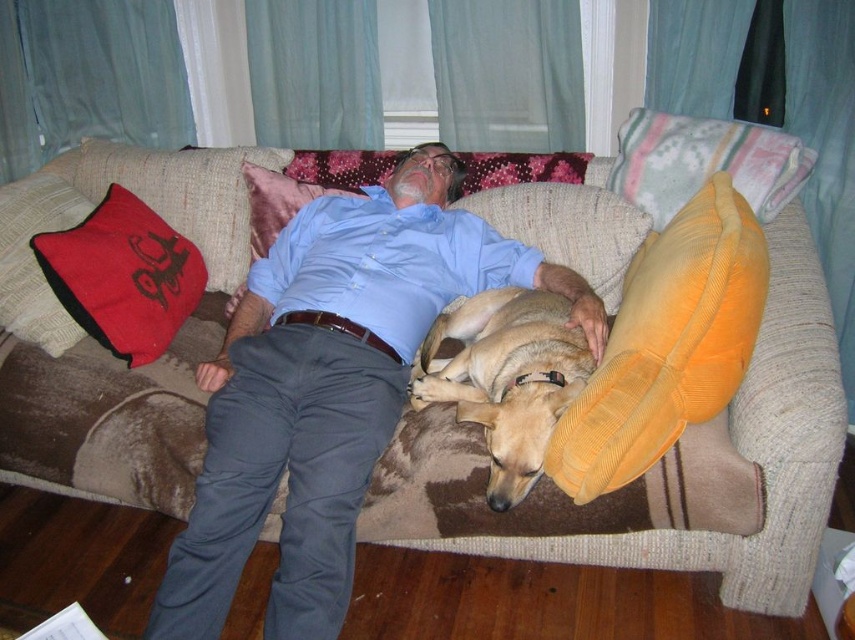
In the image, where is the brown corduroy dog at center located in terms of coordinates?

The brown corduroy dog at center is located at coordinates point (506, 378).

You are standing in the living room and want to place a small plant between the two points marked as point (287, 404) and point (615, 342). Which point should the plant be closer to so it appears closer to you?

The plant should be placed closer to point (287, 404) because it is further to the viewer than point (615, 342).